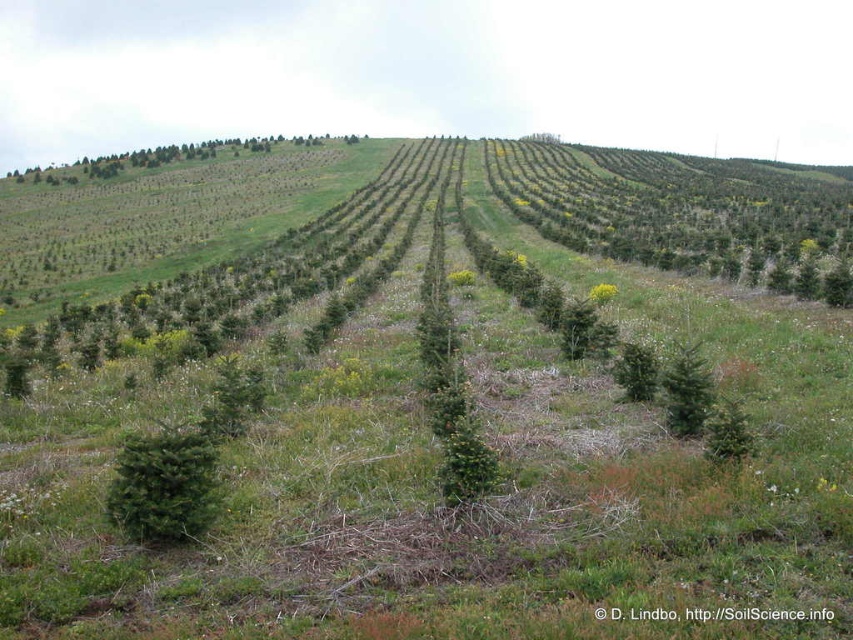
Question: Which of the following is the closest to the observer?

Choices:
 (A) green matte tree at lower left
 (B) green matte evergreen tree at center
 (C) green textured tree at center

Answer: (A)

Question: Does green matte tree at lower left come behind green textured tree at center?

Choices:
 (A) yes
 (B) no

Answer: (B)

Question: Does green matte evergreen tree at center come behind green textured tree at center?

Choices:
 (A) yes
 (B) no

Answer: (B)

Question: Considering the real-world distances, which object is farthest from the green matte evergreen tree at center?

Choices:
 (A) green matte evergreen tree at center-right
 (B) green textured tree at center

Answer: (B)

Question: Can you confirm if green matte evergreen tree at center-right is positioned below green textured tree at center?

Choices:
 (A) yes
 (B) no

Answer: (A)

Question: Which of the following is the closest to the observer?

Choices:
 (A) (144, 448)
 (B) (680, 349)
 (C) (730, 419)
 (D) (625, 346)

Answer: (A)